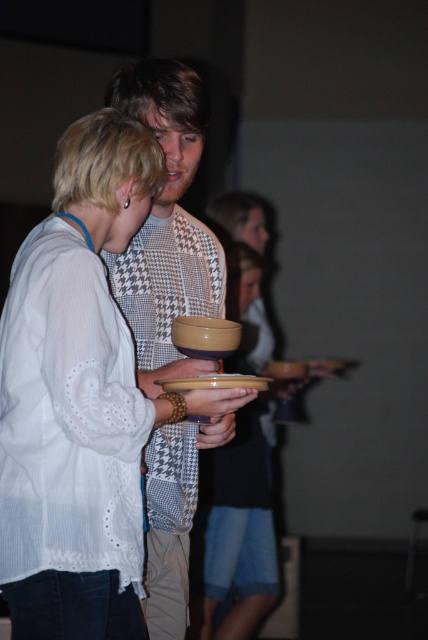
Which of these two, houndstooth fabric shirt at center or matte ceramic plate at center, stands shorter?

matte ceramic plate at center is shorter.

Who is more forward, (x=205, y=292) or (x=246, y=387)?

Point (x=246, y=387) is in front.

Which is in front, point (183, 275) or point (198, 376)?

Positioned in front is point (198, 376).

Locate an element on the screen. The image size is (428, 640). houndstooth fabric shirt at center is located at coordinates (166, 221).

Does houndstooth fabric shirt at center lie behind matte yellow bowl at center?

No, it is not.

Between houndstooth fabric shirt at center and matte yellow bowl at center, which one has more height?

Standing taller between the two is houndstooth fabric shirt at center.

Image resolution: width=428 pixels, height=640 pixels. What do you see at coordinates (166, 221) in the screenshot?
I see `houndstooth fabric shirt at center` at bounding box center [166, 221].

Identify the location of houndstooth fabric shirt at center. This screenshot has height=640, width=428. (166, 221).

Is matte yellow bowl at center behind matte ceramic plate at center?

Yes, matte yellow bowl at center is behind matte ceramic plate at center.

Between matte yellow bowl at center and matte ceramic plate at center, which one appears on the right side from the viewer's perspective?

From the viewer's perspective, matte ceramic plate at center appears more on the right side.

This screenshot has height=640, width=428. In order to click on matte yellow bowl at center in this screenshot , I will do `click(166, 218)`.